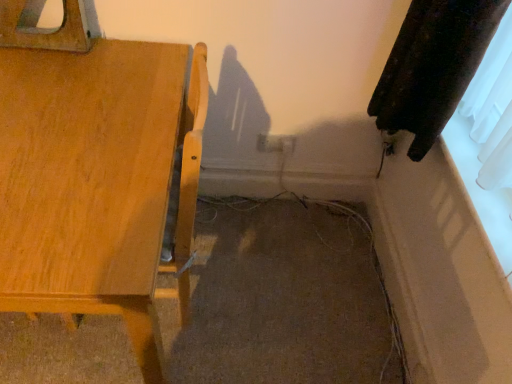
Question: Based on their positions, is white plastic electric outlet at center located to the left or right of wooden table at left?

Choices:
 (A) right
 (B) left

Answer: (A)

Question: From a real-world perspective, is white plastic electric outlet at center physically located above or below wooden table at left?

Choices:
 (A) below
 (B) above

Answer: (A)

Question: From the image's perspective, relative to wooden table at left, is white plastic electric outlet at center above or below?

Choices:
 (A) below
 (B) above

Answer: (B)

Question: Visually, is wooden table at left positioned to the left or to the right of white plastic electric outlet at center?

Choices:
 (A) left
 (B) right

Answer: (A)

Question: Looking at their shapes, would you say wooden table at left is wider or thinner than white plastic electric outlet at center?

Choices:
 (A) thin
 (B) wide

Answer: (B)

Question: Is wooden table at left inside the boundaries of white plastic electric outlet at center, or outside?

Choices:
 (A) outside
 (B) inside

Answer: (A)

Question: Is point (131, 266) closer or farther from the camera than point (287, 148)?

Choices:
 (A) closer
 (B) farther

Answer: (A)